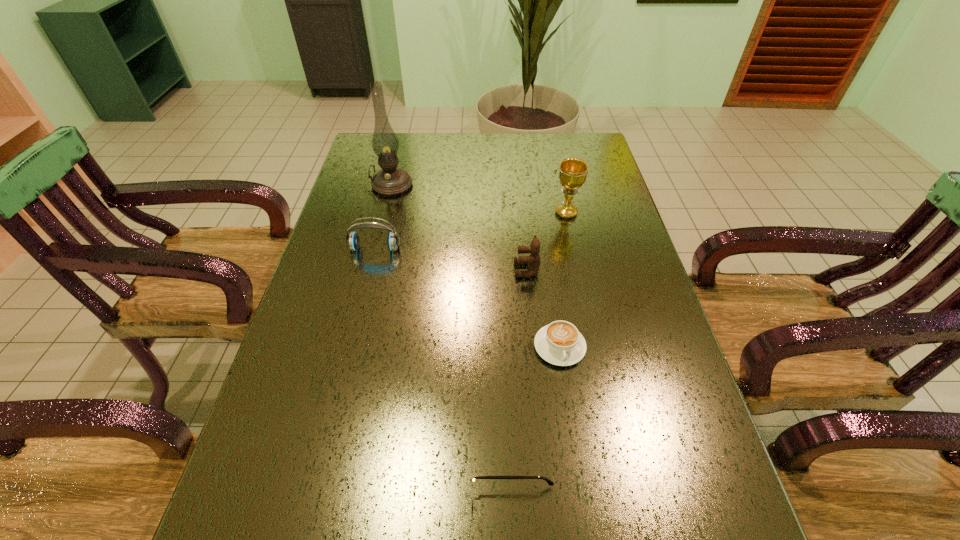
Image resolution: width=960 pixels, height=540 pixels. Identify the location of free location at the far right corner of the desktop. (564, 156).

This screenshot has height=540, width=960. What are the coordinates of `free space between the fifth nearest object and the teddy bear` in the screenshot? It's located at (546, 241).

At what (x,y) coordinates should I click in order to perform the action: click on vacant area between the third nearest object and the headset. Please return your answer as a coordinate pair (x, y). Image resolution: width=960 pixels, height=540 pixels. Looking at the image, I should click on (451, 259).

At what (x,y) coordinates should I click in order to perform the action: click on free space between the chalice and the fifth farthest object. Please return your answer as a coordinate pair (x, y). This screenshot has width=960, height=540. Looking at the image, I should click on (563, 280).

Where is `free space between the fourth nearest object and the teddy bear`? Image resolution: width=960 pixels, height=540 pixels. free space between the fourth nearest object and the teddy bear is located at coordinates (451, 259).

Where is `free spot between the cappuccino and the teddy bear`? free spot between the cappuccino and the teddy bear is located at coordinates (543, 308).

Identify which object is located as the fifth nearest to the third farthest object. Please provide its 2D coordinates. Your answer should be formatted as a tuple, i.e. [(x, y)], where the tuple contains the x and y coordinates of a point satisfying the conditions above.

[(470, 496)]

Where is `object identified as the fourth closest to the fourth farthest object`? Image resolution: width=960 pixels, height=540 pixels. object identified as the fourth closest to the fourth farthest object is located at coordinates (390, 181).